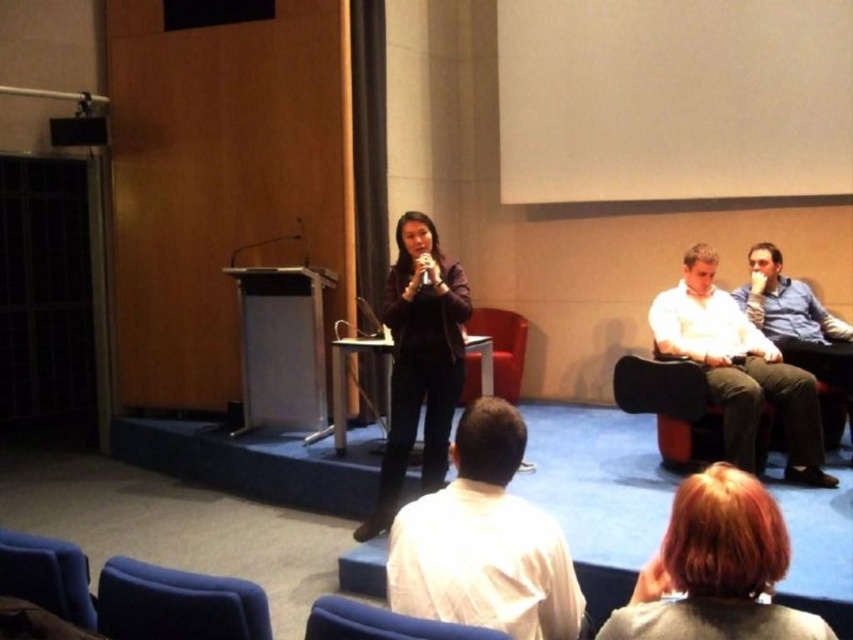
You are sitting on the velvet blue chair at lower center and want to move to the velvet blue chair at lower left. Which direction should you move in?

The velvet blue chair at lower left is above the velvet blue chair at lower center, so you should move upward to reach it.

You are attending a formal event and need to locate the speaker. Based on the scene description, which object is closer to the front of the stage? The matte black jacket at center or the blue shirt at right?

The matte black jacket at center is positioned under the blue shirt at right, indicating it is closer to the front of the stage.

You are organizing a seating arrangement for a panel discussion and need to place two speakers next to each other on a narrow bench. The bench can only accommodate one person comfortably. You see the white cotton shirt at right and the blue shirt at right in the image. Which speaker should you choose to fit on the bench?

The blue shirt at right should be chosen because it is smaller than the white cotton shirt at right, making it more likely to fit comfortably on the narrow bench.